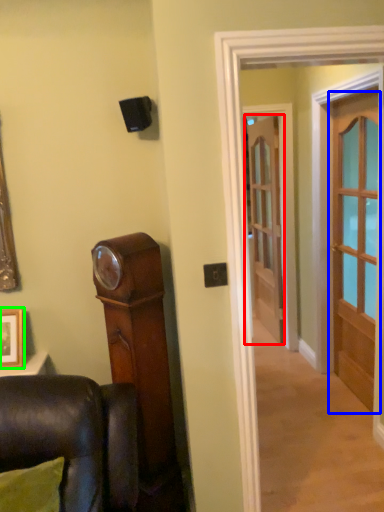
Question: Which is nearer to the door (highlighted by a red box)? door (highlighted by a blue box) or picture frame (highlighted by a green box).

Choices:
 (A) door
 (B) picture frame

Answer: (A)